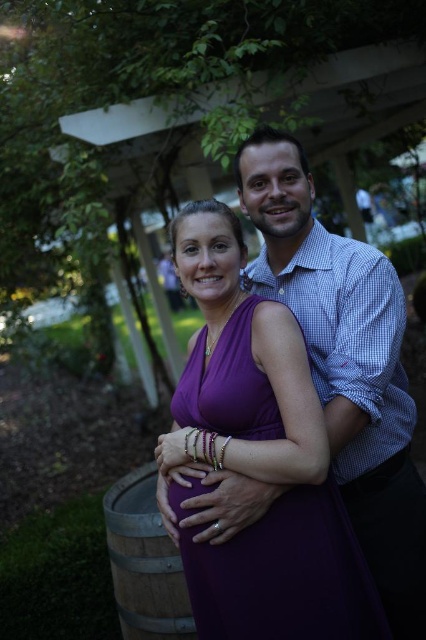
Question: Is purple satin dress at center closer to the viewer compared to wooden barrel at lower left?

Choices:
 (A) no
 (B) yes

Answer: (B)

Question: Can you confirm if purple satin dress at center is bigger than wooden barrel at lower left?

Choices:
 (A) no
 (B) yes

Answer: (B)

Question: Observing the image, what is the correct spatial positioning of purple satin dress at center in reference to wooden barrel at lower left?

Choices:
 (A) left
 (B) right

Answer: (B)

Question: Which of the following is the closest to the observer?

Choices:
 (A) wooden barrel at lower left
 (B) purple satin dress at center

Answer: (B)